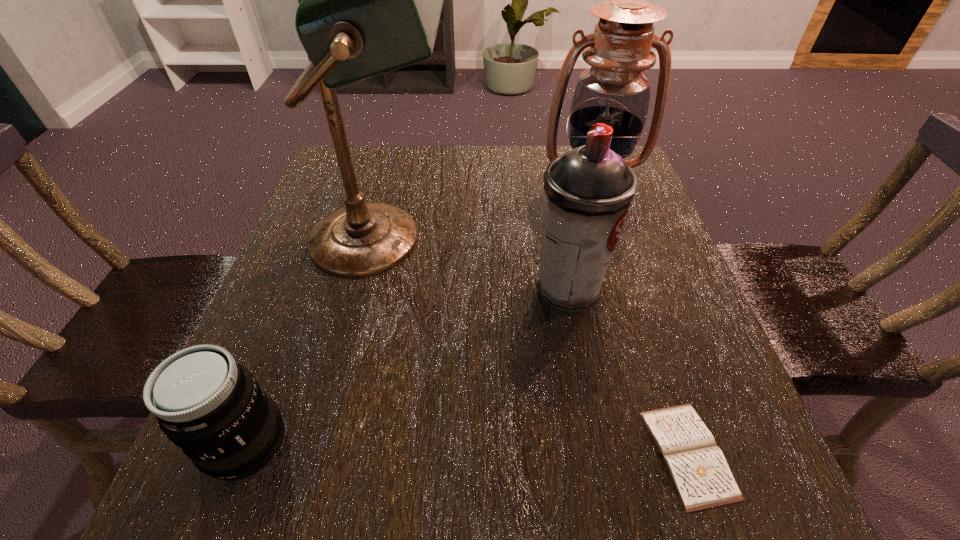
Identify the location of vacant space that satisfies the following two spatial constraints: 1. on the front side of the oil lamp; 2. above the green lampshade of the table lamp. The image size is (960, 540). (607, 239).

What are the coordinates of `vacant space that satisfies the following two spatial constraints: 1. above the green lampshade of the table lamp; 2. on the right side of the third tallest object` in the screenshot? It's located at (370, 289).

This screenshot has height=540, width=960. I want to click on free space that satisfies the following two spatial constraints: 1. above the green lampshade of the diary; 2. on the right side of the table lamp, so click(x=331, y=454).